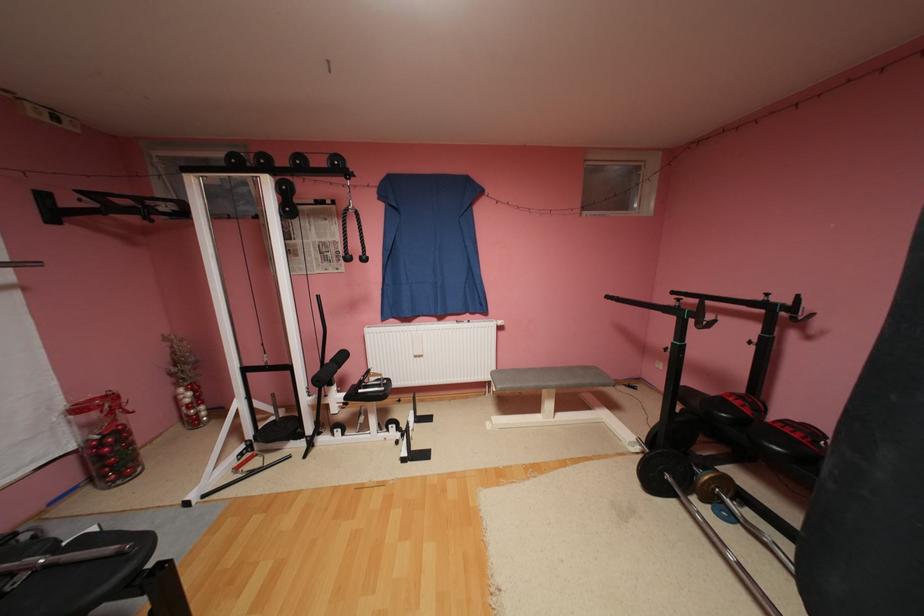
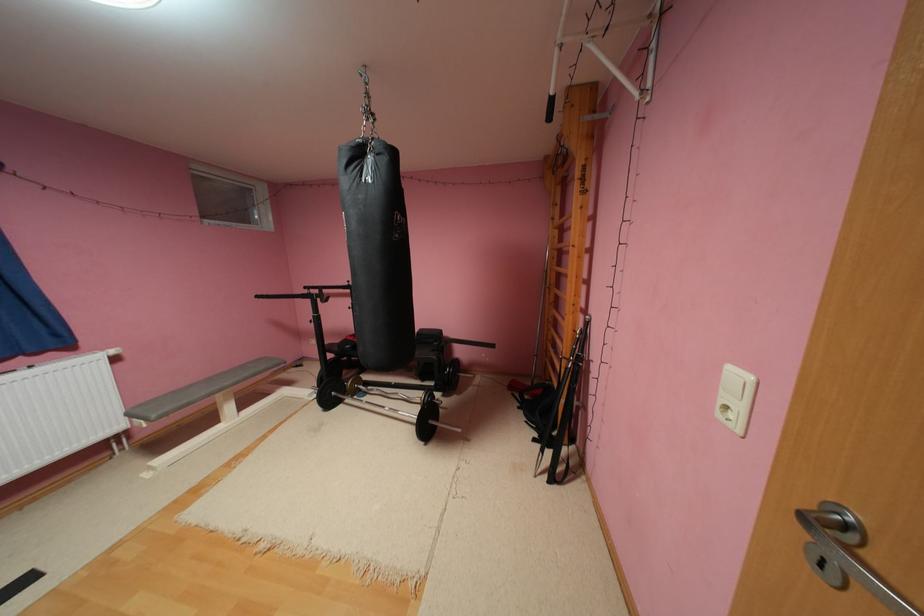
Question: The first image is from the beginning of the video and the second image is from the end. How did the camera likely rotate when shooting the video?

Choices:
 (A) Left
 (B) Right
 (C) Up
 (D) Down

Answer: (B)